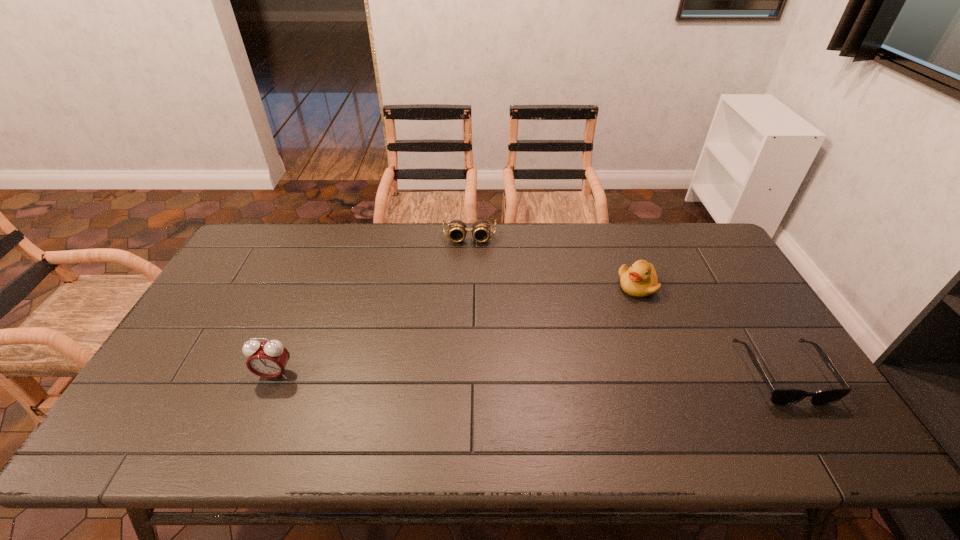
The image size is (960, 540). Find the location of `alarm clock`. alarm clock is located at coordinates (268, 359).

The height and width of the screenshot is (540, 960). What are the coordinates of `the tallest object` in the screenshot? It's located at (268, 359).

Where is `sunglasses`? This screenshot has height=540, width=960. sunglasses is located at coordinates (779, 396).

You are a GUI agent. You are given a task and a screenshot of the screen. Output one action in this format:
    pyautogui.click(x=<x>, y=<y>)
    Task: Click on the rightmost object
    Image resolution: width=960 pixels, height=540 pixels.
    Given the screenshot: What is the action you would take?
    pyautogui.click(x=779, y=396)

The height and width of the screenshot is (540, 960). Find the location of `goggles`. goggles is located at coordinates (457, 229).

I want to click on the second shortest object, so click(457, 229).

The image size is (960, 540). I want to click on the third shortest object, so click(640, 280).

At what (x,y) coordinates should I click in order to perform the action: click on the third object from left to right. Please return your answer as a coordinate pair (x, y). Looking at the image, I should click on (640, 280).

At what (x,y) coordinates should I click in order to perform the action: click on vacant space located 0.050m on the clock face of the leftmost object. Please return your answer as a coordinate pair (x, y). Looking at the image, I should click on (265, 399).

Where is `vacant space located through the lenses of the farthest object`? The image size is (960, 540). vacant space located through the lenses of the farthest object is located at coordinates (468, 256).